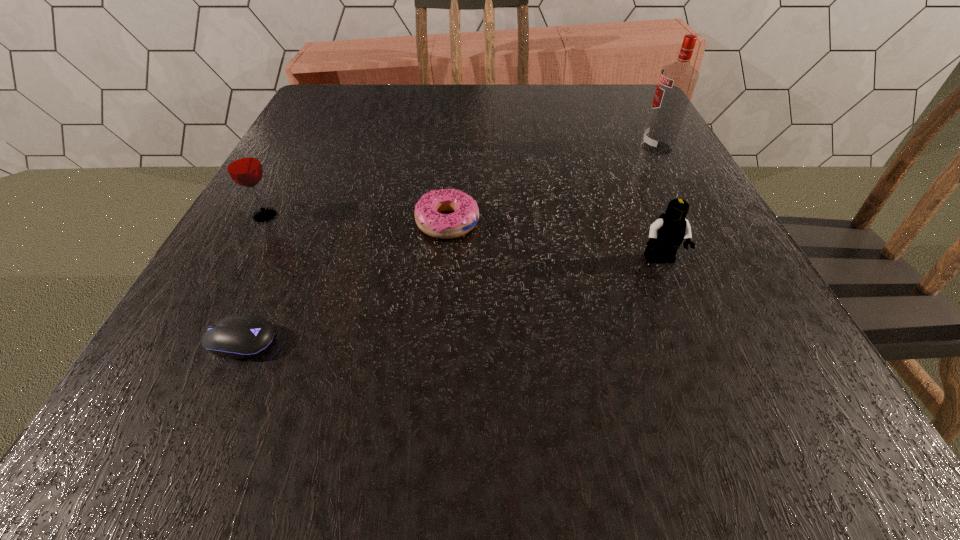
Where is `the farthest object`? the farthest object is located at coordinates click(677, 81).

The width and height of the screenshot is (960, 540). What are the coordinates of `the rightmost object` in the screenshot? It's located at (677, 81).

At what (x,y) coordinates should I click in order to perform the action: click on glass. Please return your answer as a coordinate pair (x, y). This screenshot has height=540, width=960. Looking at the image, I should click on (242, 163).

I want to click on the second nearest object, so click(666, 234).

You are a GUI agent. You are given a task and a screenshot of the screen. Output one action in this format:
    pyautogui.click(x=<x>, y=<y>)
    Task: Click on the second object from right to left
    
    Given the screenshot: What is the action you would take?
    pyautogui.click(x=666, y=234)

The height and width of the screenshot is (540, 960). I want to click on doughnut, so click(428, 217).

Locate an element on the screen. Image resolution: width=960 pixels, height=540 pixels. the second shortest object is located at coordinates (428, 217).

This screenshot has width=960, height=540. Identify the location of computer mouse. (238, 336).

Identify the location of the nearest object. (238, 336).

At what (x,y) coordinates should I click in order to perform the action: click on vacant point located 0.160m on the front label of the farthest object. Please return your answer as a coordinate pair (x, y). This screenshot has width=960, height=540. Looking at the image, I should click on (564, 148).